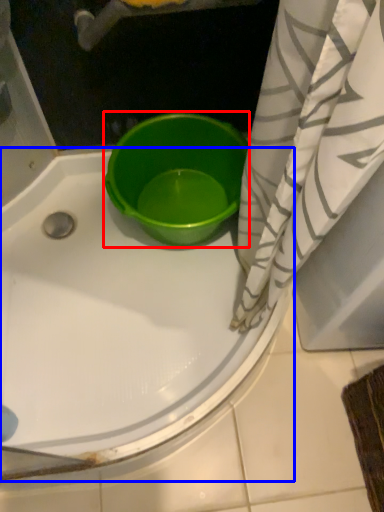
Question: Which point is further to the camera, basin (highlighted by a red box) or bathtub (highlighted by a blue box)?

Choices:
 (A) basin
 (B) bathtub

Answer: (A)